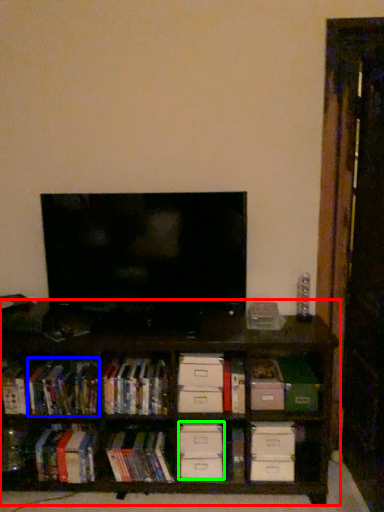
Question: Based on their relative distances, which object is nearer to shelf (highlighted by a red box)? Choose from book (highlighted by a blue box) and drawer (highlighted by a green box).

Choices:
 (A) book
 (B) drawer

Answer: (A)